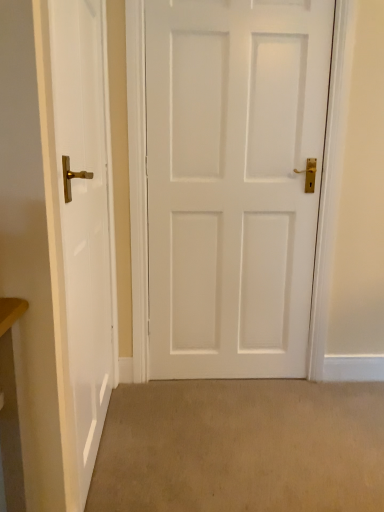
Question: Does white matte door at center, the second door positioned from the left, have a lesser width compared to beige carpet at lower center?

Choices:
 (A) yes
 (B) no

Answer: (A)

Question: Is white matte door at center, the second door positioned from the left, surrounding beige carpet at lower center?

Choices:
 (A) yes
 (B) no

Answer: (B)

Question: Is white matte door at center, placed as the 1th door when sorted from right to left, to the left of beige carpet at lower center from the viewer's perspective?

Choices:
 (A) no
 (B) yes

Answer: (B)

Question: Is white matte door at center, the second door positioned from the left, not inside beige carpet at lower center?

Choices:
 (A) yes
 (B) no

Answer: (A)

Question: Considering the relative sizes of white matte door at center, placed as the 1th door when sorted from right to left, and beige carpet at lower center in the image provided, is white matte door at center, placed as the 1th door when sorted from right to left, bigger than beige carpet at lower center?

Choices:
 (A) no
 (B) yes

Answer: (B)

Question: Is white matte door at center, placed as the 1th door when sorted from right to left, not close to beige carpet at lower center?

Choices:
 (A) no
 (B) yes

Answer: (A)

Question: From a real-world perspective, is beige carpet at lower center located beneath white glossy door at left, which appears as the 1th door when viewed from the left?

Choices:
 (A) yes
 (B) no

Answer: (A)

Question: Is beige carpet at lower center facing towards white glossy door at left, the 2th door from the right?

Choices:
 (A) yes
 (B) no

Answer: (B)

Question: From the image's perspective, is beige carpet at lower center under white glossy door at left, the 2th door from the right?

Choices:
 (A) no
 (B) yes

Answer: (B)

Question: From the image's perspective, is beige carpet at lower center located above white glossy door at left, which appears as the 1th door when viewed from the left?

Choices:
 (A) no
 (B) yes

Answer: (A)

Question: Does beige carpet at lower center appear on the right side of white glossy door at left, which appears as the 1th door when viewed from the left?

Choices:
 (A) no
 (B) yes

Answer: (B)

Question: Is beige carpet at lower center facing away from white glossy door at left, the 2th door from the right?

Choices:
 (A) no
 (B) yes

Answer: (B)

Question: Is beige carpet at lower center to the left of white matte door at center, the second door positioned from the left, from the viewer's perspective?

Choices:
 (A) no
 (B) yes

Answer: (A)